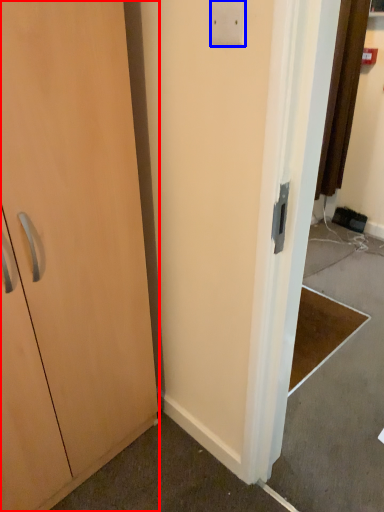
Question: Which point is closer to the camera, cabinetry (highlighted by a red box) or light switch (highlighted by a blue box)?

Choices:
 (A) cabinetry
 (B) light switch

Answer: (A)